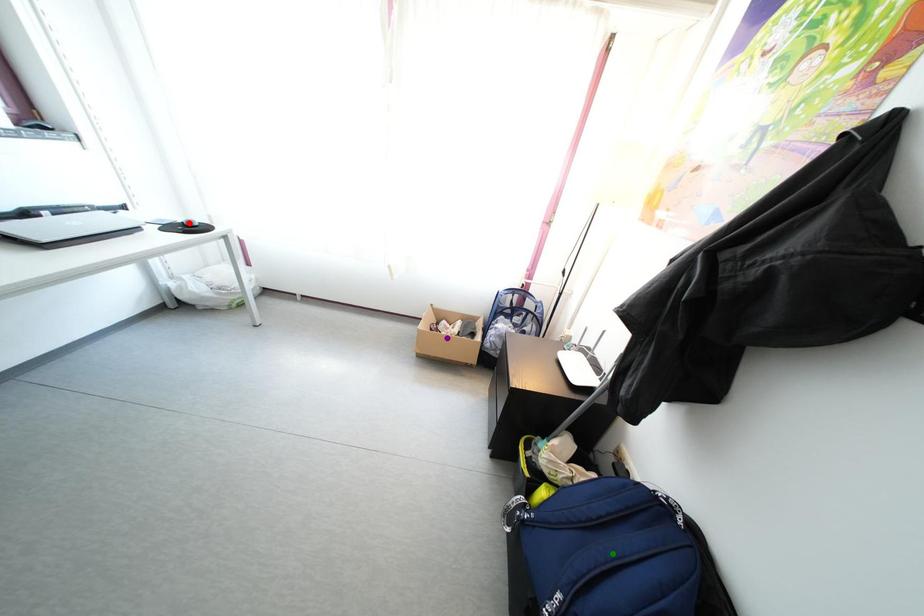
Order these from nearest to farthest:
red point, green point, purple point

purple point, red point, green point